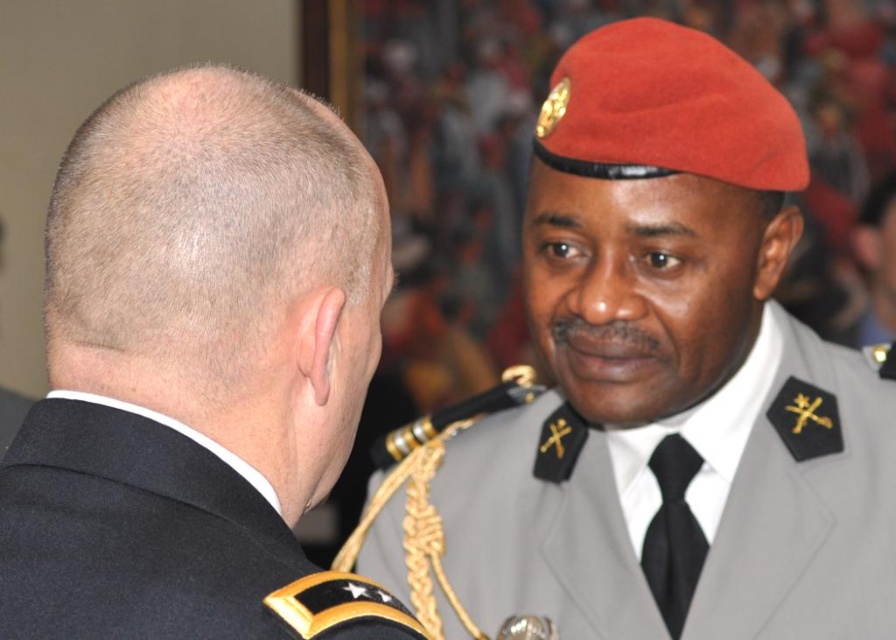
Consider the image. Can you confirm if satin red beret at upper right is positioned below black matte uniform at left?

No.

Which is more to the right, satin red beret at upper right or black matte uniform at left?

satin red beret at upper right is more to the right.

I want to click on satin red beret at upper right, so click(661, 385).

Can you confirm if satin red beret at upper right is smaller than black wool military uniform at upper left?

No, satin red beret at upper right is not smaller than black wool military uniform at upper left.

Does satin red beret at upper right have a lesser width compared to black wool military uniform at upper left?

No, satin red beret at upper right is not thinner than black wool military uniform at upper left.

You are a GUI agent. You are given a task and a screenshot of the screen. Output one action in this format:
    pyautogui.click(x=<x>, y=<y>)
    Task: Click on the satin red beret at upper right
    
    Given the screenshot: What is the action you would take?
    pyautogui.click(x=661, y=385)

Is black matte uniform at left below black wool military uniform at upper left?

No.

From the picture: Who is shorter, black matte uniform at left or black wool military uniform at upper left?

Standing shorter between the two is black wool military uniform at upper left.

Find the location of a particular element. The height and width of the screenshot is (640, 896). black matte uniform at left is located at coordinates (197, 371).